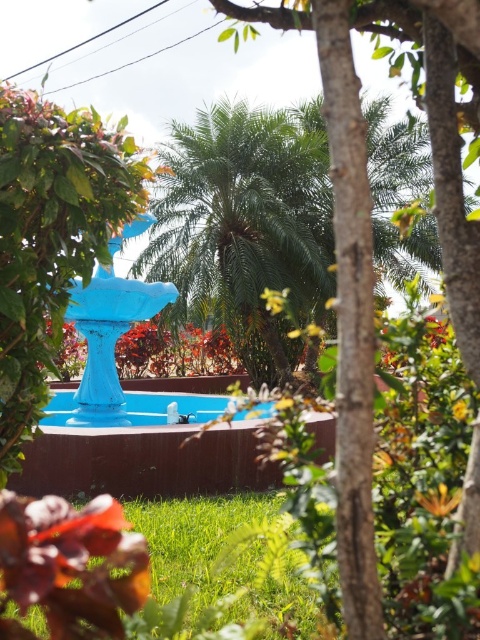
Question: Which point is farther from the camera taking this photo?

Choices:
 (A) (155, 401)
 (B) (311, 166)

Answer: (B)

Question: Which object appears closest to the camera in this image?

Choices:
 (A) blue glossy pool at center
 (B) green leafy palm at center

Answer: (A)

Question: Is green leafy palm at center above blue glossy pool at center?

Choices:
 (A) yes
 (B) no

Answer: (A)

Question: Considering the relative positions of green leafy palm at center and blue glossy pool at center in the image provided, where is green leafy palm at center located with respect to blue glossy pool at center?

Choices:
 (A) left
 (B) right

Answer: (B)

Question: Can you confirm if green leafy palm at center is positioned to the right of blue glossy pool at center?

Choices:
 (A) no
 (B) yes

Answer: (B)